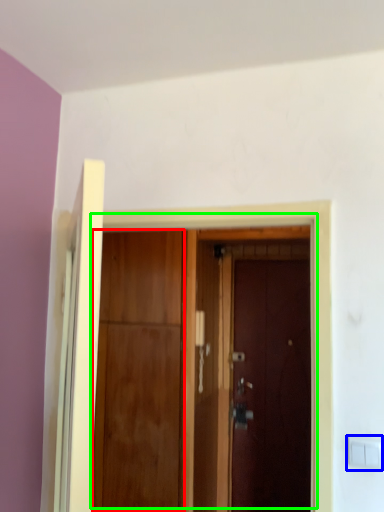
Question: Which object is positioned farthest from door (highlighted by a red box)? Select from light switch (highlighted by a blue box) and door (highlighted by a green box).

Choices:
 (A) light switch
 (B) door

Answer: (A)